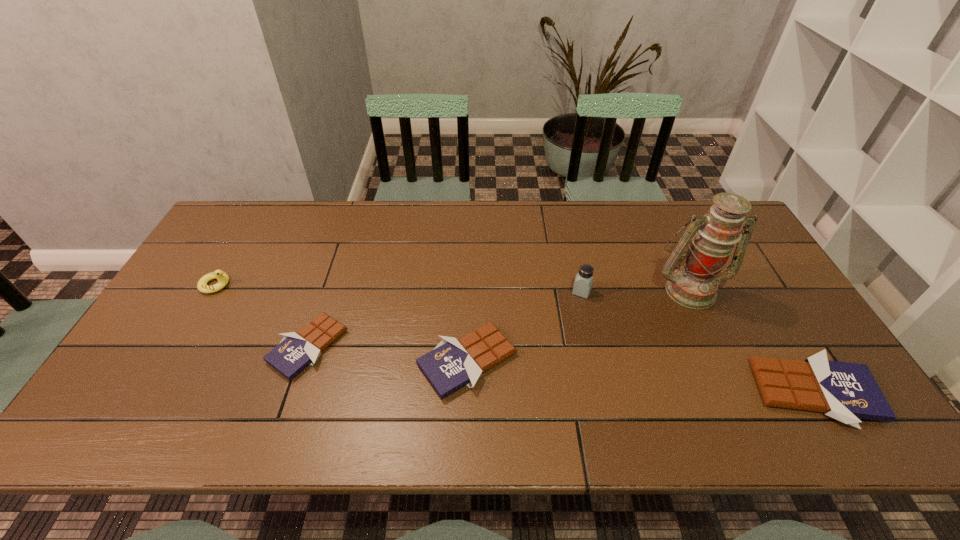
Locate an element on the screen. The height and width of the screenshot is (540, 960). free space located 0.280m on the back of the shortest chocolate bar is located at coordinates (341, 248).

Identify the location of vacant space located on the right of the second tallest chocolate bar. 558,361.

In order to click on free point located on the left of the rightmost chocolate bar in this screenshot , I will do `click(734, 392)`.

This screenshot has width=960, height=540. Identify the location of free region located on the face of the fourth shortest object. (286, 285).

This screenshot has height=540, width=960. I want to click on free region located 0.100m on the left of the tallest object, so click(x=618, y=289).

Find the location of `free space located 0.280m on the front of the saltshaker`. free space located 0.280m on the front of the saltshaker is located at coordinates (603, 386).

Find the location of a particular element. object that is at the left edge is located at coordinates (223, 279).

At what (x,y) coordinates should I click in order to perform the action: click on chocolate bar located at the right edge. Please return your answer as a coordinate pair (x, y). Looking at the image, I should click on (845, 391).

You are a GUI agent. You are given a task and a screenshot of the screen. Output one action in this format:
    pyautogui.click(x=<x>, y=<y>)
    Task: Click on the oil lamp that is at the right edge
    The width and height of the screenshot is (960, 540).
    Given the screenshot: What is the action you would take?
    pyautogui.click(x=694, y=285)

Where is `object that is at the near right corner`? The width and height of the screenshot is (960, 540). object that is at the near right corner is located at coordinates (845, 391).